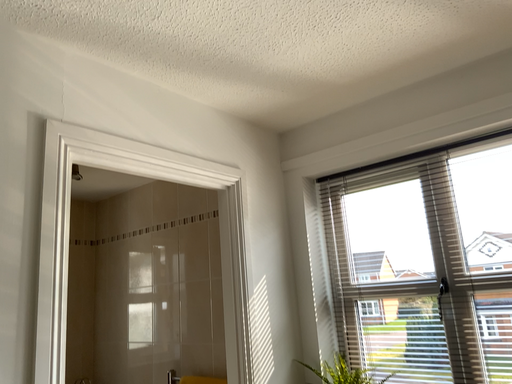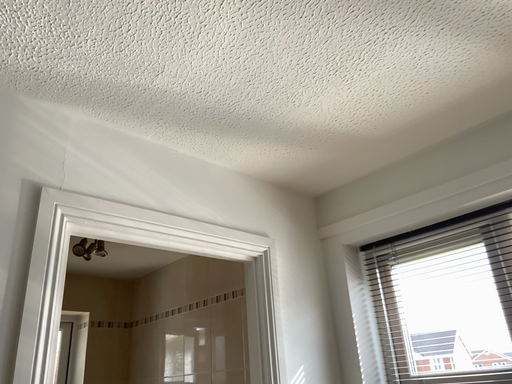
Question: How did the camera likely rotate when shooting the video?

Choices:
 (A) rotated left
 (B) rotated right

Answer: (A)